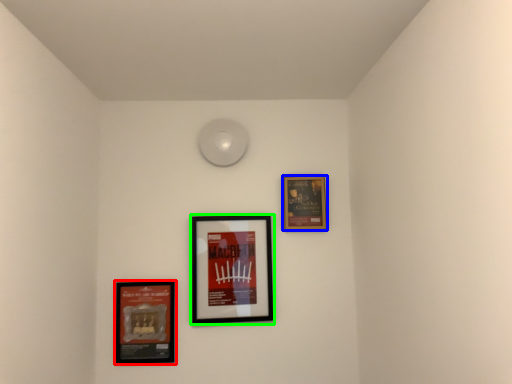
Question: Based on their relative distances, which object is farther from picture frame (highlighted by a red box)? Choose from picture frame (highlighted by a blue box) and picture frame (highlighted by a green box).

Choices:
 (A) picture frame
 (B) picture frame

Answer: (A)